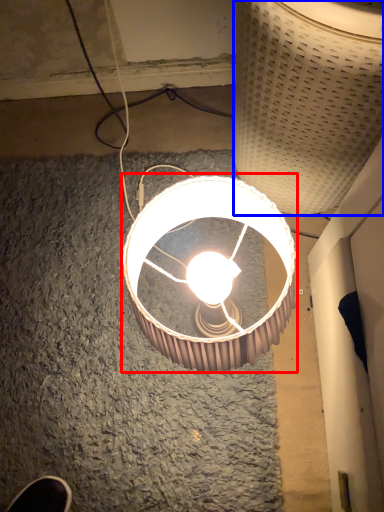
Question: Which object is further to the camera taking this photo, lamp (highlighted by a red box) or lamp (highlighted by a blue box)?

Choices:
 (A) lamp
 (B) lamp

Answer: (A)